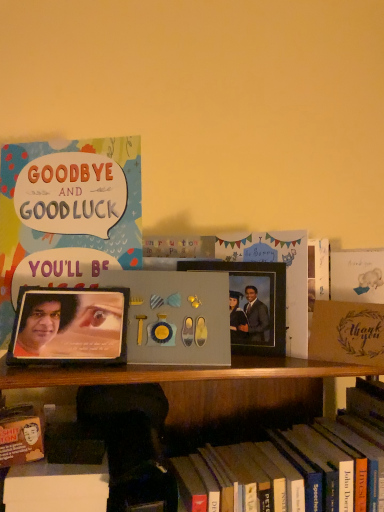
Locate an element on the screen. matte black picture frame at left, positioned as the 1th picture frame in left-to-right order is located at coordinates (69, 326).

Identify the location of matte cardstock card at upper left, arranged as the second book when ordered from the bottom. (67, 215).

Is there a large distance between metallic photo frame at center, which is the second picture frame from left to right, and brown textured paper at right?

metallic photo frame at center, which is the second picture frame from left to right, is actually quite close to brown textured paper at right.

From the image's perspective, is metallic photo frame at center, the second picture frame from the front, beneath brown textured paper at right?

No.

Identify the location of paperback book in front of the metallic photo frame at center, which is the 1th picture frame in right-to-left order. (347, 333).

From a real-world perspective, which is physically above, metallic photo frame at center, the second picture frame from the front, or brown textured paper at right?

In real-world perspective, metallic photo frame at center, the second picture frame from the front, is above.

From a real-world perspective, between matte cardstock card at upper left, arranged as the second book when ordered from the bottom, and brown textured paper at right, who is vertically lower?

In real-world perspective, brown textured paper at right is lower.

Locate an element on the screen. Image resolution: width=384 pixels, height=512 pixels. book that is the 2nd one when counting leftward from the brown textured paper at right is located at coordinates tap(67, 215).

Is matte cardstock card at upper left, arranged as the second book when ordered from the bottom, thinner than brown textured paper at right?

Yes, matte cardstock card at upper left, arranged as the second book when ordered from the bottom, is thinner than brown textured paper at right.

Does matte cardstock card at upper left, arranged as the second book when ordered from the bottom, have a lesser height compared to brown textured paper at right?

Incorrect, the height of matte cardstock card at upper left, arranged as the second book when ordered from the bottom, does not fall short of that of brown textured paper at right.

From the image's perspective, which is above, hardcover book at lower center, which is the 2th book in top-to-bottom order, or metallic photo frame at center, which is the 1th picture frame in right-to-left order?

From the image's view, metallic photo frame at center, which is the 1th picture frame in right-to-left order, is above.

Identify the location of book on the right of metallic photo frame at center, acting as the first picture frame starting from the back. This screenshot has width=384, height=512. (278, 452).

Can you confirm if matte cardstock card at upper left, arranged as the second book when ordered from the bottom, is smaller than metallic photo frame at center, acting as the first picture frame starting from the back?

Incorrect, matte cardstock card at upper left, arranged as the second book when ordered from the bottom, is not smaller in size than metallic photo frame at center, acting as the first picture frame starting from the back.

From a real-world perspective, is matte cardstock card at upper left, which is the first book from top to bottom, positioned above or below metallic photo frame at center, which is the 1th picture frame in right-to-left order?

From a real-world perspective, matte cardstock card at upper left, which is the first book from top to bottom, is physically above metallic photo frame at center, which is the 1th picture frame in right-to-left order.

Is matte cardstock card at upper left, which ranks as the second book in right-to-left order, positioned far away from metallic photo frame at center, acting as the first picture frame starting from the back?

matte cardstock card at upper left, which ranks as the second book in right-to-left order, is near metallic photo frame at center, acting as the first picture frame starting from the back, not far away.

Which of these two, brown textured paper at right or metallic photo frame at center, acting as the first picture frame starting from the back, is thinner?

metallic photo frame at center, acting as the first picture frame starting from the back, is thinner.

Which is in front, point (350, 346) or point (283, 289)?

The point (350, 346) is more forward.

Considering the sizes of objects brown textured paper at right and metallic photo frame at center, which is the 1th picture frame in right-to-left order, in the image provided, who is bigger, brown textured paper at right or metallic photo frame at center, which is the 1th picture frame in right-to-left order,?

brown textured paper at right.

Would you say brown textured paper at right is a long distance from matte cardstock card at upper left, which is the 1th book in left-to-right order?

No, brown textured paper at right is in close proximity to matte cardstock card at upper left, which is the 1th book in left-to-right order.

What's the angular difference between brown textured paper at right and matte cardstock card at upper left, which is the 1th book in left-to-right order,'s facing directions?

brown textured paper at right and matte cardstock card at upper left, which is the 1th book in left-to-right order, are facing 15 degrees away from each other.

From the picture: Considering the sizes of objects brown textured paper at right and matte cardstock card at upper left, which is the first book from top to bottom, in the image provided, who is wider, brown textured paper at right or matte cardstock card at upper left, which is the first book from top to bottom,?

Wider between the two is brown textured paper at right.

Is brown textured paper at right positioned with its back to matte cardstock card at upper left, which ranks as the second book in right-to-left order?

No, brown textured paper at right is not facing away from matte cardstock card at upper left, which ranks as the second book in right-to-left order.

Is matte black picture frame at left, which appears as the 2th picture frame when viewed from the back, thinner than metallic photo frame at center, which is the 1th picture frame in right-to-left order?

No, matte black picture frame at left, which appears as the 2th picture frame when viewed from the back, is not thinner than metallic photo frame at center, which is the 1th picture frame in right-to-left order.

Could you measure the distance between matte black picture frame at left, which appears as the 2th picture frame when viewed from the back, and metallic photo frame at center, acting as the first picture frame starting from the back?

A distance of 8.41 inches exists between matte black picture frame at left, which appears as the 2th picture frame when viewed from the back, and metallic photo frame at center, acting as the first picture frame starting from the back.

Between matte black picture frame at left, which appears as the first picture frame when viewed from the front, and metallic photo frame at center, the second picture frame from the front, which one appears on the left side from the viewer's perspective?

Positioned to the left is matte black picture frame at left, which appears as the first picture frame when viewed from the front.

Considering the relative sizes of matte black picture frame at left, marked as the second picture frame in a right-to-left arrangement, and metallic photo frame at center, which is the second picture frame from left to right, in the image provided, is matte black picture frame at left, marked as the second picture frame in a right-to-left arrangement, taller than metallic photo frame at center, which is the second picture frame from left to right,?

Yes.

Image resolution: width=384 pixels, height=512 pixels. What are the coordinates of `picture frame that appears behind the brown textured paper at right` in the screenshot? It's located at (253, 304).

Locate an element on the screen. paperback book that is on the right side of matte cardstock card at upper left, which is the first book from top to bottom is located at coordinates (347, 333).

Considering their positions, is matte cardstock card at upper left, which ranks as the second book in right-to-left order, positioned closer to hardcover book at lower center, which is the 1th book in right-to-left order, than metallic photo frame at center, which is the second picture frame from left to right?

metallic photo frame at center, which is the second picture frame from left to right, lies closer to hardcover book at lower center, which is the 1th book in right-to-left order, than the other object.

When comparing their distances from metallic photo frame at center, which is the 1th picture frame in right-to-left order, does matte black picture frame at left, marked as the second picture frame in a right-to-left arrangement, or brown textured paper at right seem closer?

Based on the image, brown textured paper at right appears to be nearer to metallic photo frame at center, which is the 1th picture frame in right-to-left order.

Considering their positions, is hardcover book at lower center, which is the 1th book in right-to-left order, positioned further to brown textured paper at right than metallic photo frame at center, the second picture frame from the front?

hardcover book at lower center, which is the 1th book in right-to-left order, is further to brown textured paper at right.

Which object lies nearer to the anchor point matte black picture frame at left, positioned as the 1th picture frame in left-to-right order, metallic photo frame at center, which is the 1th picture frame in right-to-left order, or matte cardstock card at upper left, which is the first book from top to bottom?

The object closer to matte black picture frame at left, positioned as the 1th picture frame in left-to-right order, is matte cardstock card at upper left, which is the first book from top to bottom.

When comparing their distances from brown textured paper at right, does matte black picture frame at left, marked as the second picture frame in a right-to-left arrangement, or hardcover book at lower center, which is the 1th book in right-to-left order, seem further?

Based on the image, matte black picture frame at left, marked as the second picture frame in a right-to-left arrangement, appears to be further to brown textured paper at right.

Considering their positions, is brown textured paper at right positioned closer to matte black picture frame at left, which appears as the first picture frame when viewed from the front, than matte cardstock card at upper left, which is the first book from top to bottom?

Based on the image, matte cardstock card at upper left, which is the first book from top to bottom, appears to be nearer to matte black picture frame at left, which appears as the first picture frame when viewed from the front.

From the image, which object appears to be nearer to metallic photo frame at center, the second picture frame from the front, hardcover book at lower center, which is the 1th book in right-to-left order, or brown textured paper at right?

Based on the image, brown textured paper at right appears to be nearer to metallic photo frame at center, the second picture frame from the front.

Which object lies further to the anchor point matte black picture frame at left, which appears as the 2th picture frame when viewed from the back, hardcover book at lower center, acting as the 2th book starting from the left, or matte cardstock card at upper left, which ranks as the second book in right-to-left order?

Among the two, hardcover book at lower center, acting as the 2th book starting from the left, is located further to matte black picture frame at left, which appears as the 2th picture frame when viewed from the back.

Where is `paperback book between metallic photo frame at center, which is the second picture frame from left to right, and hardcover book at lower center, acting as the 2th book starting from the left, from top to bottom`? Image resolution: width=384 pixels, height=512 pixels. paperback book between metallic photo frame at center, which is the second picture frame from left to right, and hardcover book at lower center, acting as the 2th book starting from the left, from top to bottom is located at coordinates (347, 333).

I want to click on book situated between matte cardstock card at upper left, which is the first book from top to bottom, and brown textured paper at right from left to right, so click(278, 452).

Find the location of `book situated between matte black picture frame at left, which appears as the first picture frame when viewed from the front, and brown textured paper at right from left to right`. book situated between matte black picture frame at left, which appears as the first picture frame when viewed from the front, and brown textured paper at right from left to right is located at coordinates (278, 452).

Identify the location of picture frame situated between matte cardstock card at upper left, arranged as the second book when ordered from the bottom, and metallic photo frame at center, which is the second picture frame from left to right, from left to right. This screenshot has width=384, height=512. (69, 326).